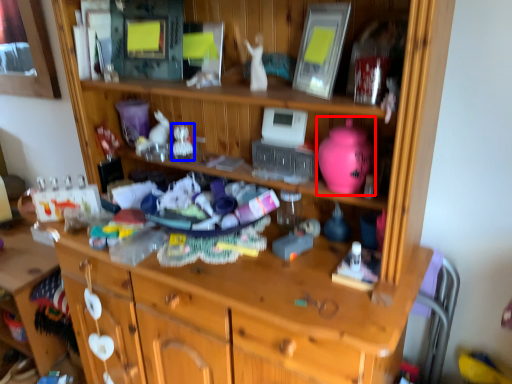
Question: Which object is closer to the camera taking this photo, toy (highlighted by a red box) or toy (highlighted by a blue box)?

Choices:
 (A) toy
 (B) toy

Answer: (A)